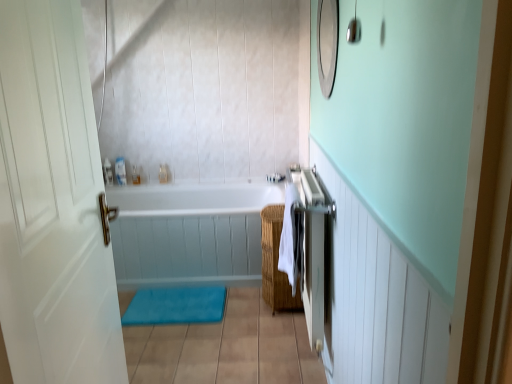
Question: Are woven brown basket at center and blue fabric bath mat at lower center located far from each other?

Choices:
 (A) no
 (B) yes

Answer: (A)

Question: Is blue fabric bath mat at lower center at the back of woven brown basket at center?

Choices:
 (A) yes
 (B) no

Answer: (B)

Question: From the image's perspective, is woven brown basket at center beneath blue fabric bath mat at lower center?

Choices:
 (A) yes
 (B) no

Answer: (B)

Question: Does woven brown basket at center have a greater height compared to blue fabric bath mat at lower center?

Choices:
 (A) no
 (B) yes

Answer: (B)

Question: Considering the relative positions of woven brown basket at center and blue fabric bath mat at lower center in the image provided, is woven brown basket at center to the right of blue fabric bath mat at lower center from the viewer's perspective?

Choices:
 (A) yes
 (B) no

Answer: (A)

Question: Is translucent plastic container at upper center, the first toiletry when ordered from right to left, inside or outside of translucent plastic soap dispenser at upper center, which ranks as the second toiletry in right-to-left order?

Choices:
 (A) outside
 (B) inside

Answer: (A)

Question: From the image's perspective, relative to translucent plastic soap dispenser at upper center, which ranks as the second toiletry in right-to-left order, is translucent plastic container at upper center, which ranks as the 3th toiletry in left-to-right order, above or below?

Choices:
 (A) above
 (B) below

Answer: (A)

Question: Considering their positions, is translucent plastic container at upper center, which ranks as the 3th toiletry in left-to-right order, located in front of or behind translucent plastic soap dispenser at upper center, marked as the 2th toiletry in a left-to-right arrangement?

Choices:
 (A) front
 (B) behind

Answer: (B)

Question: Looking at the image, does translucent plastic container at upper center, which ranks as the 3th toiletry in left-to-right order, seem bigger or smaller compared to translucent plastic soap dispenser at upper center, which ranks as the second toiletry in right-to-left order?

Choices:
 (A) small
 (B) big

Answer: (A)

Question: Visually, is clear plastic bottle at upper left, placed as the third toiletry when sorted from right to left, positioned to the left or to the right of woven brown basket at center?

Choices:
 (A) right
 (B) left

Answer: (B)

Question: From the image's perspective, is clear plastic bottle at upper left, positioned as the first toiletry in left-to-right order, positioned above or below woven brown basket at center?

Choices:
 (A) above
 (B) below

Answer: (A)

Question: Considering the positions of clear plastic bottle at upper left, placed as the third toiletry when sorted from right to left, and woven brown basket at center in the image, is clear plastic bottle at upper left, placed as the third toiletry when sorted from right to left, taller or shorter than woven brown basket at center?

Choices:
 (A) short
 (B) tall

Answer: (A)

Question: Is clear plastic bottle at upper left, positioned as the first toiletry in left-to-right order, situated inside woven brown basket at center or outside?

Choices:
 (A) inside
 (B) outside

Answer: (B)

Question: Considering the relative positions of clear plastic bottle at upper left, positioned as the first toiletry in left-to-right order, and white glossy bathtub at center in the image provided, is clear plastic bottle at upper left, positioned as the first toiletry in left-to-right order, to the left or to the right of white glossy bathtub at center?

Choices:
 (A) left
 (B) right

Answer: (A)

Question: Is clear plastic bottle at upper left, positioned as the first toiletry in left-to-right order, taller or shorter than white glossy bathtub at center?

Choices:
 (A) tall
 (B) short

Answer: (B)